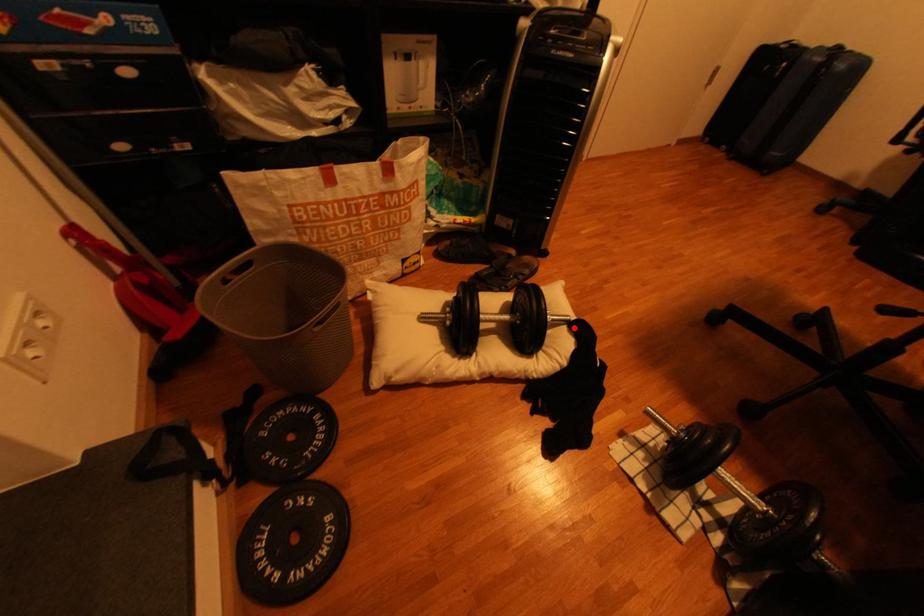
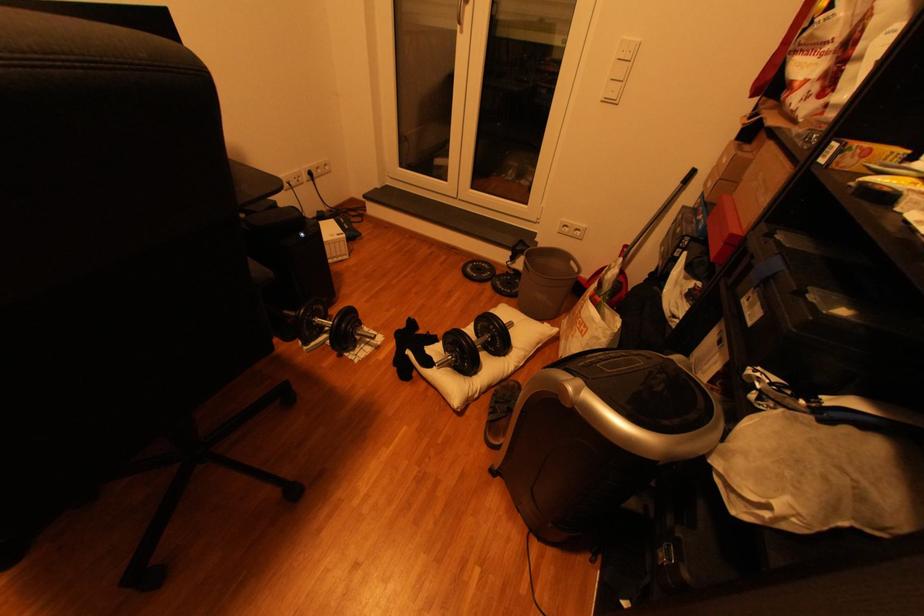
The point at the highlighted location is marked in the first image. Where is the corresponding point in the second image?

(445, 361)